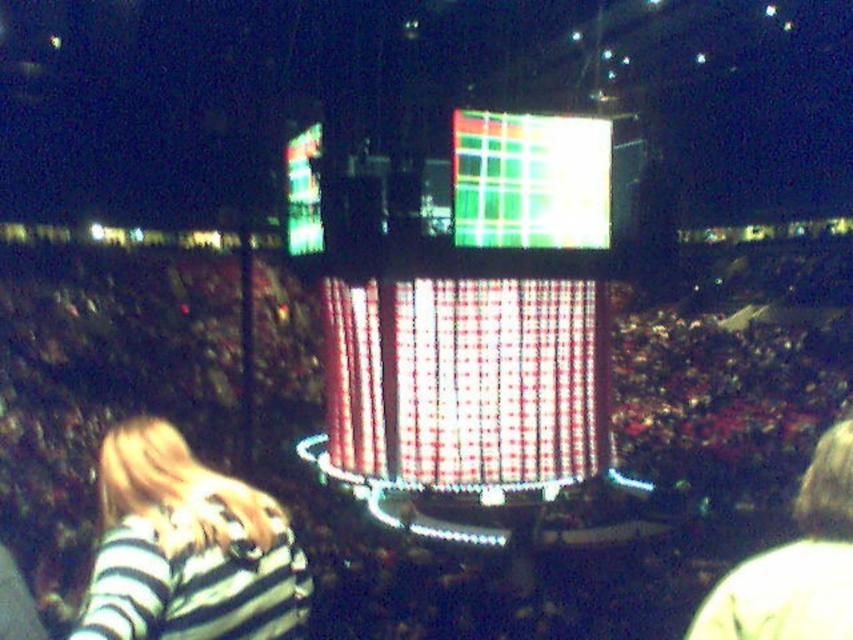
Between point (149, 500) and point (468, 192), which one is positioned behind?

The point (468, 192) is behind.

Which of these two, striped fabric shirt at lower left or shiny plastic screen at center, stands taller?

With more height is shiny plastic screen at center.

Describe the element at coordinates (187, 548) in the screenshot. The height and width of the screenshot is (640, 853). I see `striped fabric shirt at lower left` at that location.

You are a GUI agent. You are given a task and a screenshot of the screen. Output one action in this format:
    pyautogui.click(x=<x>, y=<y>)
    Task: Click on the striped fabric shirt at lower left
    Image resolution: width=853 pixels, height=640 pixels.
    Given the screenshot: What is the action you would take?
    pyautogui.click(x=187, y=548)

Does black fabric crowd at center have a lesser width compared to striped fabric shirt at lower left?

No, black fabric crowd at center is not thinner than striped fabric shirt at lower left.

Does point (77, 275) come behind point (151, 460)?

Yes, it is.

The height and width of the screenshot is (640, 853). I want to click on black fabric crowd at center, so click(616, 451).

Between black fabric crowd at center and shiny plastic screen at center, which one is positioned higher?

shiny plastic screen at center

Is point (61, 620) positioned in front of point (608, 129)?

Yes, it is.

I want to click on black fabric crowd at center, so click(x=616, y=451).